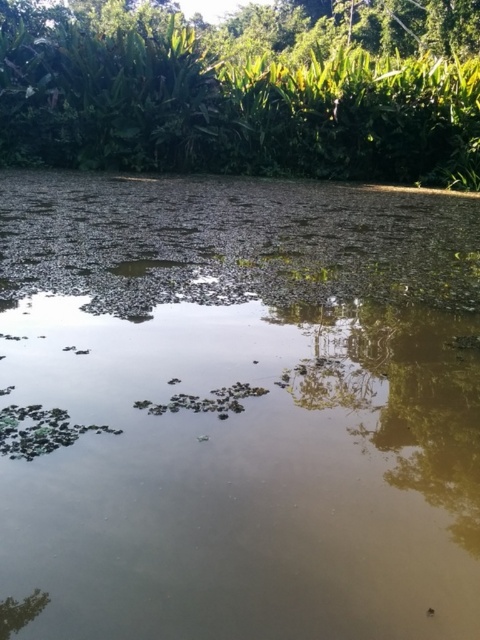
You are standing on the edge of the pond and want to place a 2m wide floating dock. The dock must be placed where the brown murky water at center is. Is the space between the green leafy trees at upper center wide enough to accommodate the dock?

The brown murky water at center is narrower than the green leafy trees at upper center, so the space between the green leafy trees at upper center is wider than the dock. However, the dock must be placed where the brown murky water at center is, which is narrower than the trees. Therefore, the dock may not fit in the area of the brown murky water at center since its width is insufficient.

You are standing at the edge of the pond and want to take a photo that includes both point A at point (268, 337) and point B at point (54, 93). Since point A is closer to you than point B, will point A appear larger in the photo?

Yes, point A at point (268, 337) will appear larger in the photo than point B at point (54, 93) because it is closer to the camera.